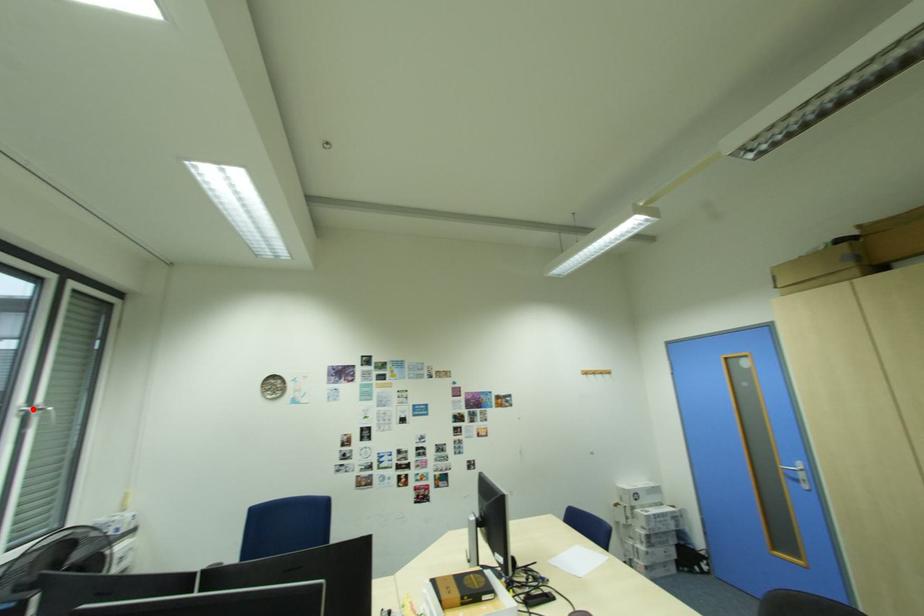
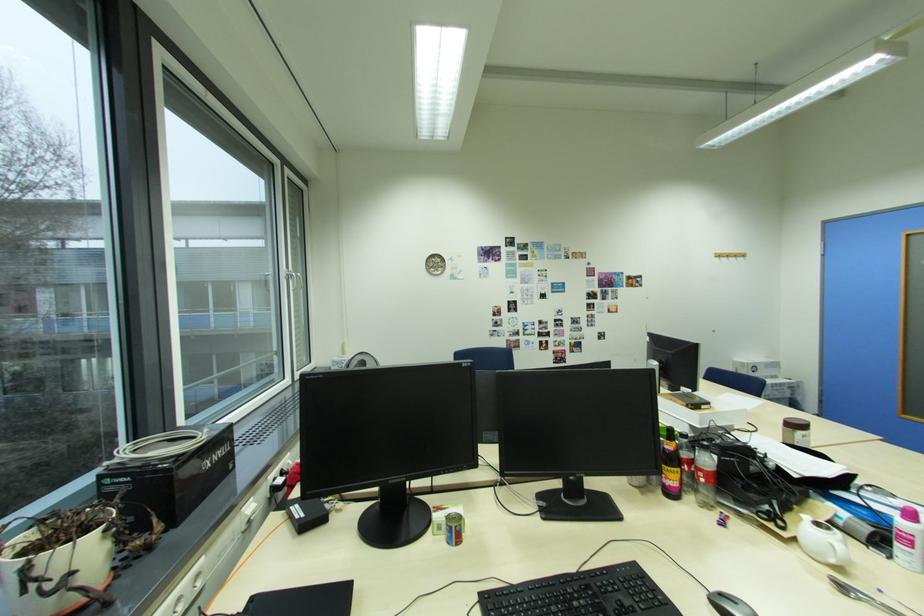
Question: I am providing you with two images of the same scene from different viewpoints. A red point is shown in image1. For the corresponding object point in image2, is it positioned nearer or farther from the camera?

Choices:
 (A) Nearer
 (B) Farther

Answer: (B)